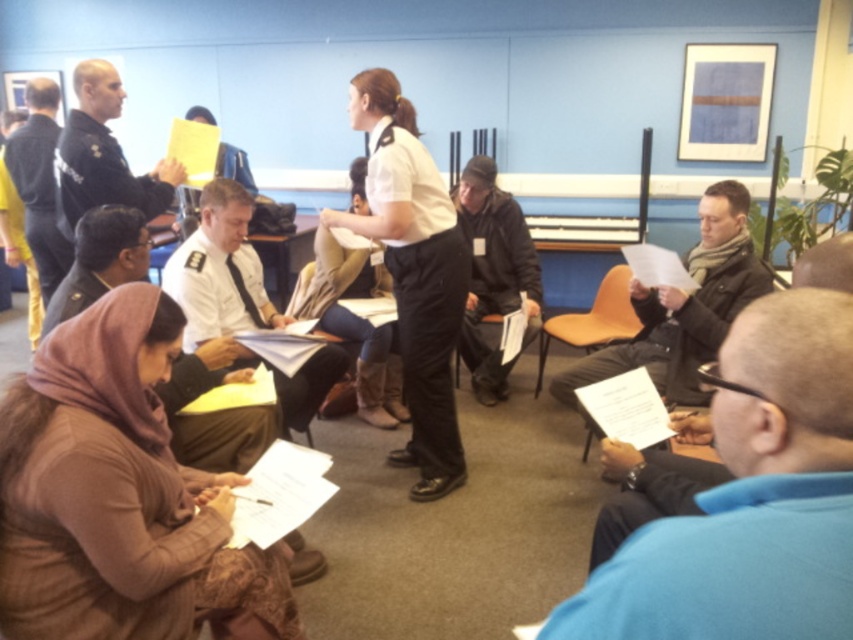
You are standing at the entrance of the conference room and need to locate the person wearing the white uniform at center. According to the coordinates provided, where should you look to find them?

The white uniform at center is located at point coordinates (413, 273), so you should look towards the center of the room where those coordinates intersect.